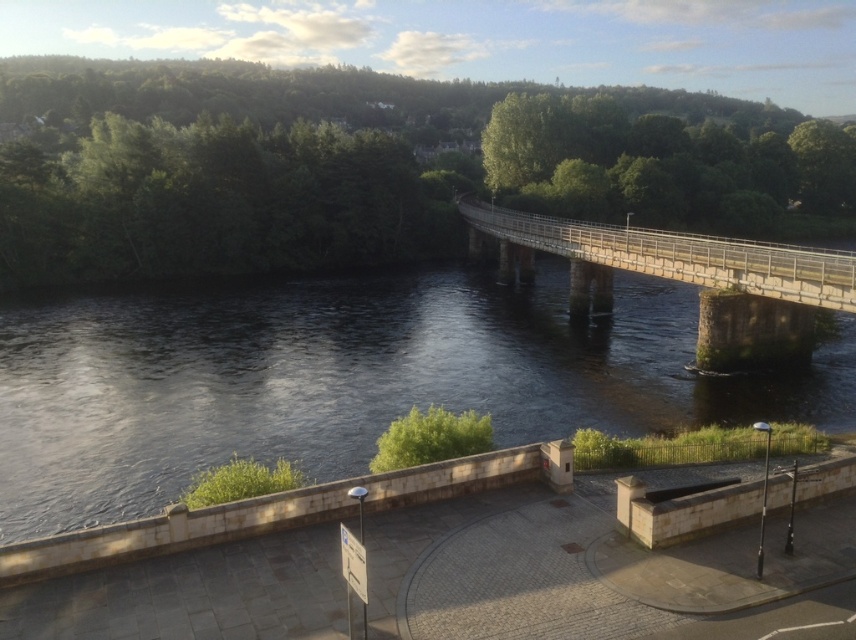
You are a tourist standing on the riverside path. You want to take a photo of the stone bridge at center and the dark water at center. Which object should you focus on first if you want to capture both in one frame without moving the camera?

The dark water at center is shorter than the stone bridge at center, so you should focus on the stone bridge at center first to ensure it stays in frame while adjusting for the dark water at center.

You are standing at the point labeled as point (345, 378) in the image. Describe what you see directly below you.

Directly below you at point (345, 378) is dark water at center.

You are a tourist standing on the riverside path and want to take a photo of the stone bridge at center and the dark water at center. Which object should you focus on first to ensure both are in the frame?

The dark water at center is in front of the stone bridge at center, so you should focus on the stone bridge at center first to ensure both are in the frame.